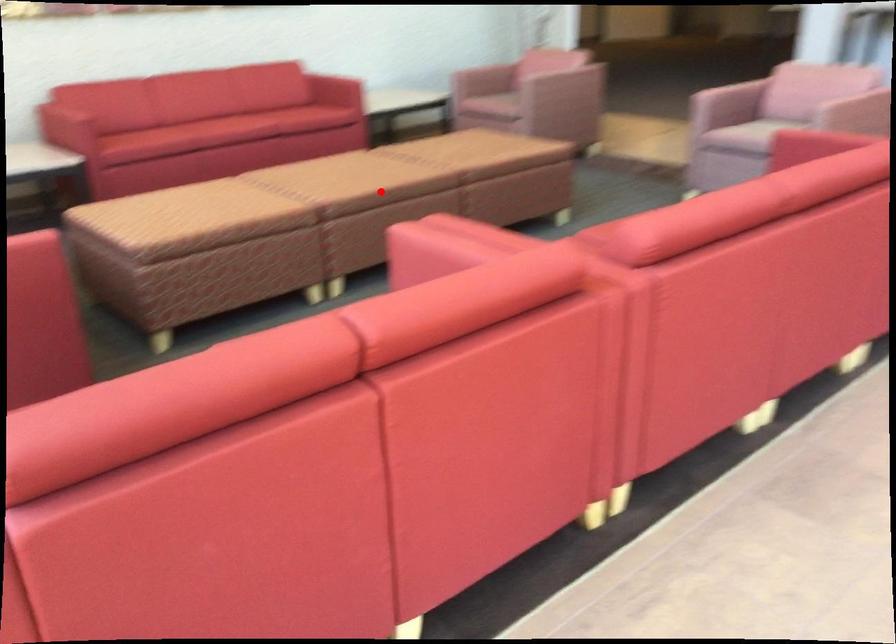
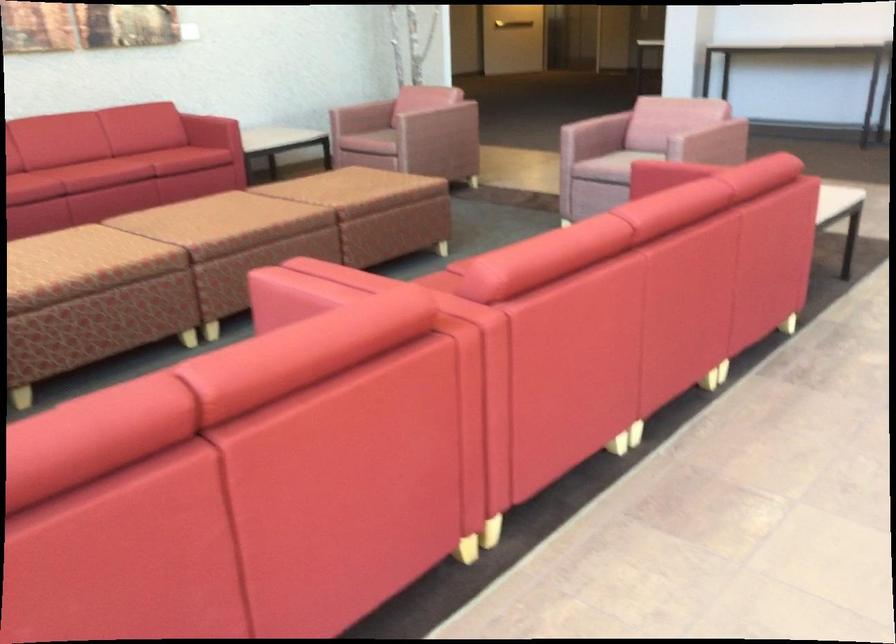
Locate, in the second image, the point that corresponds to the highlighted location in the first image.

(254, 234)